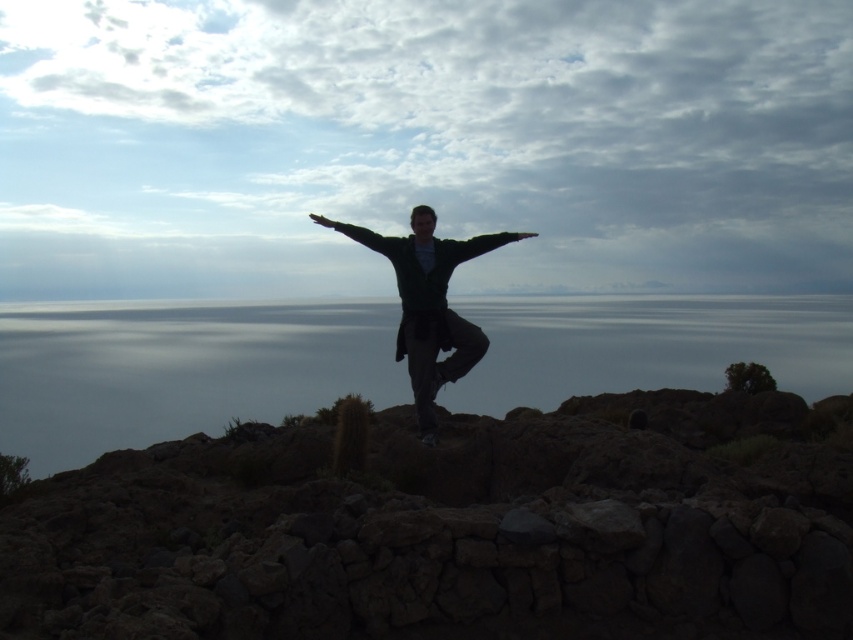
Question: Is the position of dark stone wall at center more distant than that of gray water at center?

Choices:
 (A) yes
 (B) no

Answer: (B)

Question: Which object appears farthest from the camera in this image?

Choices:
 (A) dark stone wall at center
 (B) gray water at center
 (C) dark green sweater at center

Answer: (C)

Question: Which point appears closest to the camera in this image?

Choices:
 (A) (598, 490)
 (B) (421, 372)

Answer: (A)

Question: Is gray water at center to the right of dark green sweater at center from the viewer's perspective?

Choices:
 (A) no
 (B) yes

Answer: (B)

Question: Is dark stone wall at center smaller than dark green sweater at center?

Choices:
 (A) no
 (B) yes

Answer: (B)

Question: Which object appears farthest from the camera in this image?

Choices:
 (A) gray water at center
 (B) dark green sweater at center
 (C) dark stone wall at center

Answer: (B)